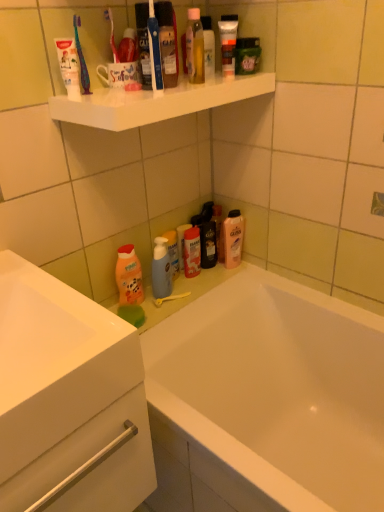
This screenshot has width=384, height=512. I want to click on free location to the right of translucent plastic pump bottle at lower center, which is the 3th toiletry in front-to-back order, so click(205, 280).